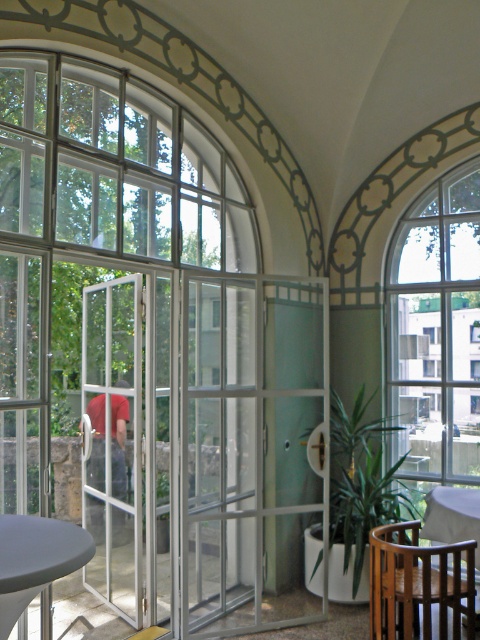
Who is more forward, (439, 358) or (330, 524)?

Point (330, 524) is in front.

Is clear glass window at right in front of green leafy plant at center?

No.

Who is more forward, (447, 410) or (363, 465)?

Point (447, 410) is more forward.

You are a GUI agent. You are given a task and a screenshot of the screen. Output one action in this format:
    pyautogui.click(x=<x>, y=<y>)
    Task: Click on the clear glass window at right
    
    Given the screenshot: What is the action you would take?
    pyautogui.click(x=436, y=332)

Can you confirm if matte gray table at lower left is thinner than wooden table at lower right?

Incorrect, matte gray table at lower left's width is not less than wooden table at lower right's.

Can you confirm if matte gray table at lower left is wider than wooden table at lower right?

Indeed, matte gray table at lower left has a greater width compared to wooden table at lower right.

Is point (75, 531) less distant than point (435, 536)?

Yes, it is in front of point (435, 536).

Identify the location of matte gray table at lower left. This screenshot has width=480, height=640. (36, 560).

Consider the image. Measure the distance between point (103, 492) and camera.

Point (103, 492) is 14.40 feet from camera.

Does white glass door at center have a greater height compared to green leafy plant at center?

Yes, white glass door at center is taller than green leafy plant at center.

The image size is (480, 640). What do you see at coordinates (113, 442) in the screenshot?
I see `white glass door at center` at bounding box center [113, 442].

What are the coordinates of `white glass door at center` in the screenshot? It's located at (113, 442).